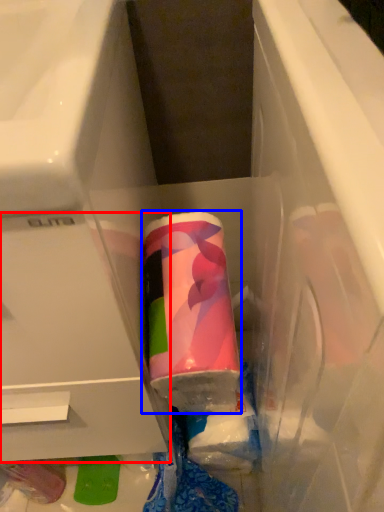
Question: Among these objects, which one is farthest to the camera, drawer (highlighted by a red box) or toothpaste (highlighted by a blue box)?

Choices:
 (A) drawer
 (B) toothpaste

Answer: (B)